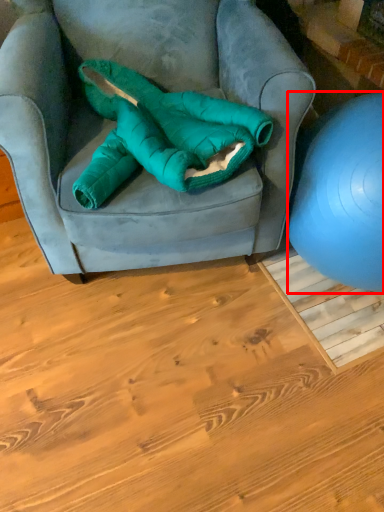
Question: From the image, what is the correct spatial relationship of ball (annotated by the red box) in relation to bean bag chair?

Choices:
 (A) right
 (B) left

Answer: (A)